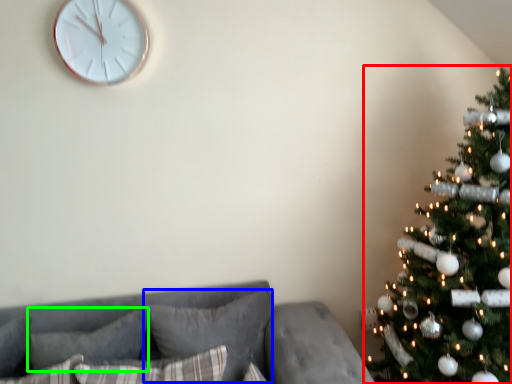
Question: Considering the real-world distances, which object is closest to christmas tree (highlighted by a red box)? pillow (highlighted by a blue box) or pillow (highlighted by a green box).

Choices:
 (A) pillow
 (B) pillow

Answer: (A)